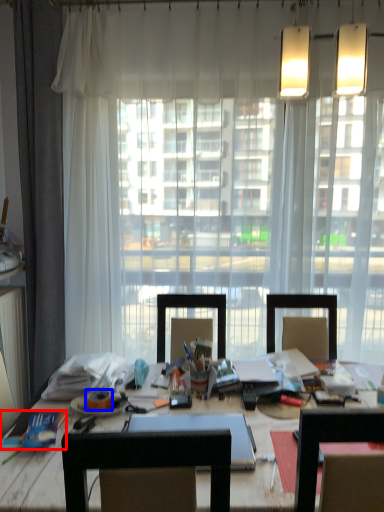
Question: Which object is further to the camera taking this photo, book (highlighted by a red box) or adhesive tape (highlighted by a blue box)?

Choices:
 (A) book
 (B) adhesive tape

Answer: (B)